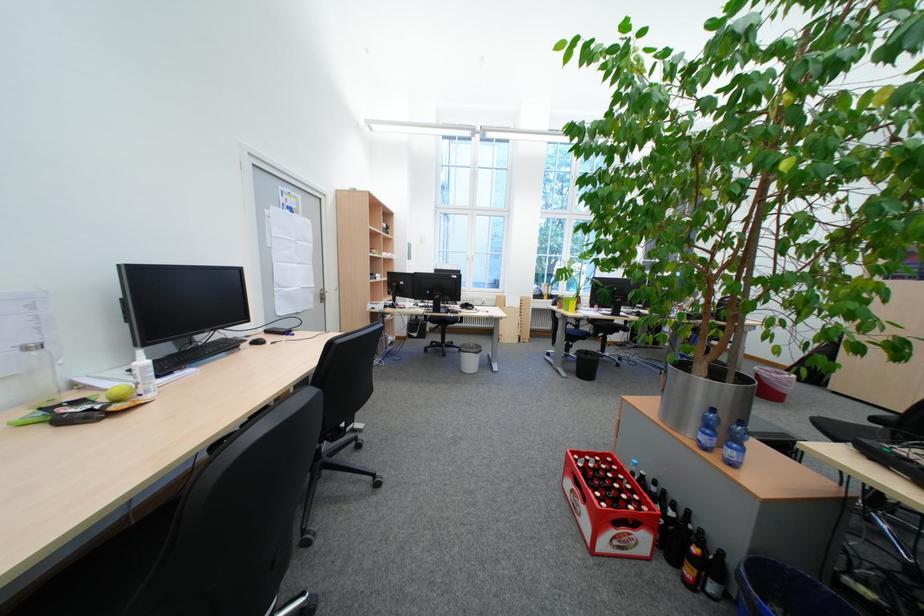
The height and width of the screenshot is (616, 924). Find the location of `grey door handle`. grey door handle is located at coordinates (322, 294).